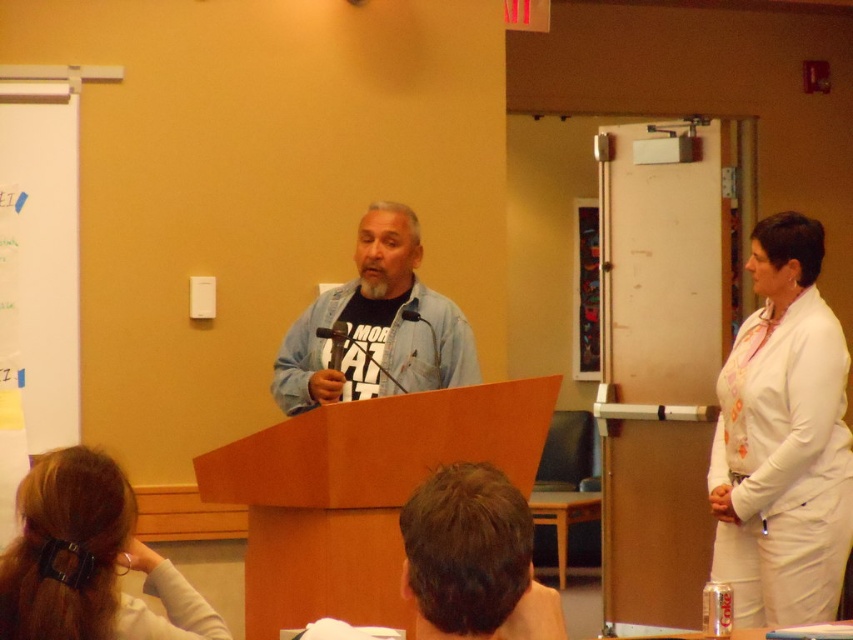
Between blonde hair at lower left and metallic black microphone at center, which one is positioned lower?

blonde hair at lower left is below.

Between point (73, 552) and point (325, 332), which one is positioned in front?

Point (73, 552)

Where is `blonde hair at lower left`? The height and width of the screenshot is (640, 853). blonde hair at lower left is located at coordinates (90, 561).

Does white fabric blouse at right have a smaller size compared to denim jacket at center?

Incorrect, white fabric blouse at right is not smaller in size than denim jacket at center.

Which of these two, white fabric blouse at right or denim jacket at center, stands shorter?

Standing shorter between the two is denim jacket at center.

Who is more forward, [762,544] or [421,353]?

Positioned in front is point [762,544].

The height and width of the screenshot is (640, 853). I want to click on white fabric blouse at right, so click(x=782, y=440).

Does denim jacket at center appear on the left side of metallic black microphone at center?

Incorrect, denim jacket at center is not on the left side of metallic black microphone at center.

Does denim jacket at center appear on the right side of metallic black microphone at center?

Correct, you'll find denim jacket at center to the right of metallic black microphone at center.

Which is behind, point (375, 307) or point (325, 328)?

Point (375, 307)

Image resolution: width=853 pixels, height=640 pixels. In order to click on denim jacket at center in this screenshot , I will do `click(376, 326)`.